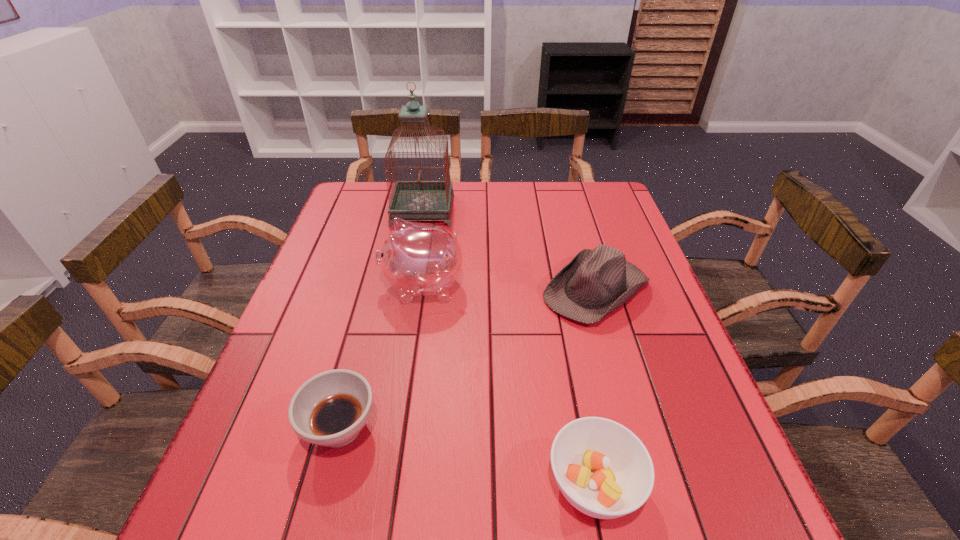
Identify the location of birdcage. The width and height of the screenshot is (960, 540). (418, 199).

What are the coordinates of `the tallest object` in the screenshot? It's located at (418, 199).

Locate an element on the screen. The image size is (960, 540). piggy bank is located at coordinates (418, 259).

Identify the location of fedora. The image size is (960, 540). (594, 283).

Identify the location of the left soup bowl. (330, 409).

At what (x,y) coordinates should I click in order to perform the action: click on the right soup bowl. Please return your answer as a coordinate pair (x, y). The width and height of the screenshot is (960, 540). Looking at the image, I should click on (602, 468).

Find the location of a particular element. free location located at the door of the birdcage is located at coordinates (481, 210).

This screenshot has height=540, width=960. In order to click on free space located on the front facing side of the piggy bank in this screenshot , I will do `click(342, 287)`.

The width and height of the screenshot is (960, 540). I want to click on vacant space located on the front facing side of the piggy bank, so pos(302,287).

Where is `vacant space situated 0.070m on the front facing side of the piggy bank`? This screenshot has width=960, height=540. vacant space situated 0.070m on the front facing side of the piggy bank is located at coordinates (354, 287).